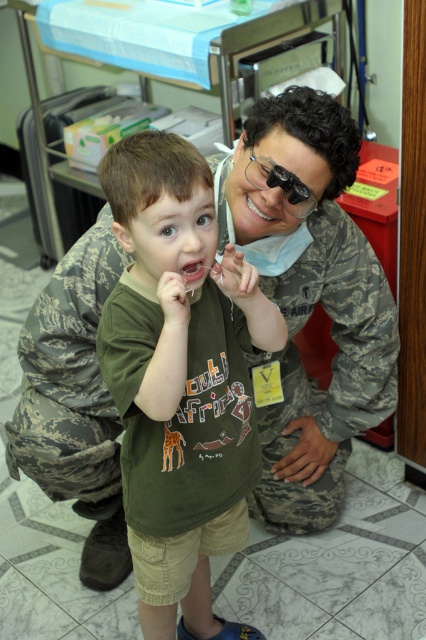
Is camouflage uniform at center to the right of green matte shirt at center from the viewer's perspective?

Indeed, camouflage uniform at center is positioned on the right side of green matte shirt at center.

What are the coordinates of `camouflage uniform at center` in the screenshot? It's located at (310, 298).

The width and height of the screenshot is (426, 640). Describe the element at coordinates (310, 298) in the screenshot. I see `camouflage uniform at center` at that location.

Locate an element on the screen. camouflage uniform at center is located at coordinates (310, 298).